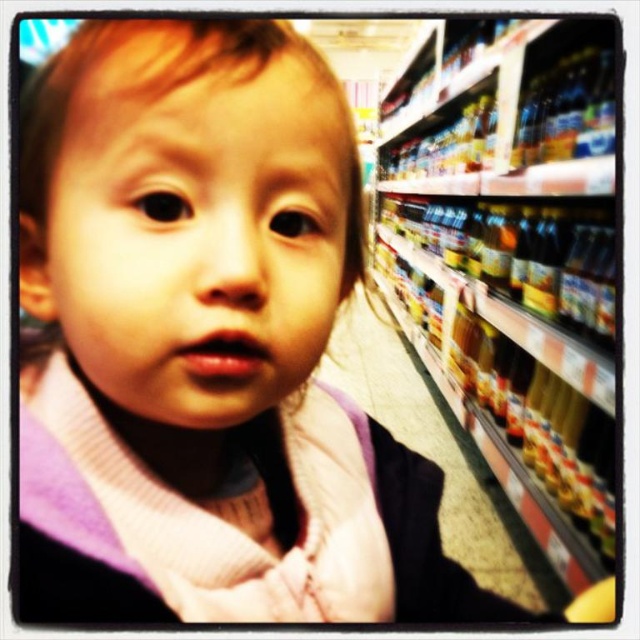
Question: Can you confirm if metallic glass bottles at right is positioned to the left of translucent plastic bottles at right?

Choices:
 (A) no
 (B) yes

Answer: (A)

Question: Among these objects, which one is nearest to the camera?

Choices:
 (A) metallic glass bottles at right
 (B) translucent plastic bottles at right

Answer: (A)

Question: Can you confirm if metallic glass bottles at right is positioned to the left of translucent plastic bottles at right?

Choices:
 (A) yes
 (B) no

Answer: (B)

Question: Is metallic glass bottles at right closer to the viewer compared to translucent plastic bottles at right?

Choices:
 (A) no
 (B) yes

Answer: (B)